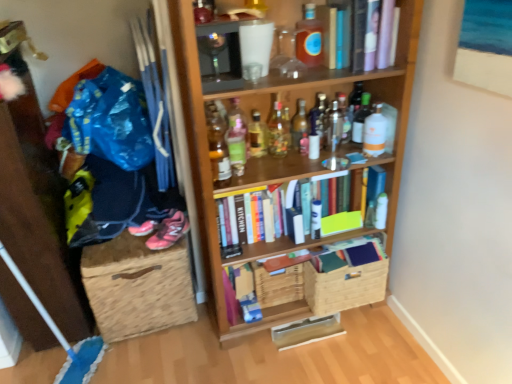
At what (x,y) coordinates should I click in order to perform the action: click on free spot in front of wooden bookcase at center. Please return your answer as a coordinate pair (x, y). Looking at the image, I should click on (304, 363).